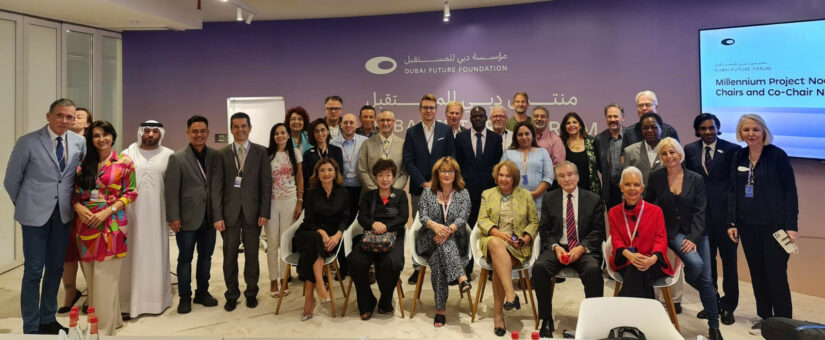
The height and width of the screenshot is (340, 825). What are the coordinates of `ceiling` in the screenshot? It's located at point(121,11).